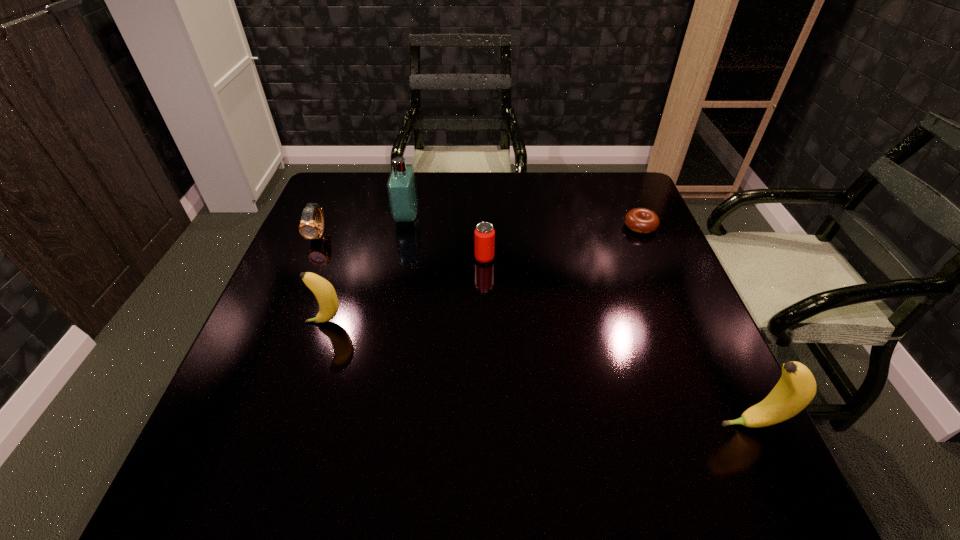
Identify the location of unoccupied area between the fourth object from left to right and the doughnut. The width and height of the screenshot is (960, 540). (563, 242).

Locate which object ranks in proximity to the leftmost object. Please provide its 2D coordinates. Your answer should be formatted as a tuple, i.e. [(x, y)], where the tuple contains the x and y coordinates of a point satisfying the conditions above.

[(402, 192)]

At what (x,y) coordinates should I click in order to perform the action: click on object that is the fourth closest to the shortest object. Please return your answer as a coordinate pair (x, y). This screenshot has height=540, width=960. Looking at the image, I should click on (323, 290).

The width and height of the screenshot is (960, 540). In order to click on free space that satisfies the following two spatial constraints: 1. on the front label of the shortest object; 2. on the right side of the perfume in this screenshot , I will do `click(405, 226)`.

You are a GUI agent. You are given a task and a screenshot of the screen. Output one action in this format:
    pyautogui.click(x=<x>, y=<y>)
    Task: Click on the vacant position in the image that satisfies the following two spatial constraints: 1. on the front label of the perfume; 2. on the left side of the third object from right to left
    The height and width of the screenshot is (540, 960).
    Given the screenshot: What is the action you would take?
    pyautogui.click(x=398, y=258)

Where is `vacant space that satisfies the following two spatial constraints: 1. on the front label of the third object from left to right; 2. on the back side of the shortest object`? This screenshot has width=960, height=540. vacant space that satisfies the following two spatial constraints: 1. on the front label of the third object from left to right; 2. on the back side of the shortest object is located at coordinates click(x=405, y=226).

What are the coordinates of `free location that satisfies the following two spatial constraints: 1. on the front label of the fourth object from right to left; 2. on the face of the leftmost object` in the screenshot? It's located at (403, 235).

You are a GUI agent. You are given a task and a screenshot of the screen. Output one action in this format:
    pyautogui.click(x=<x>, y=<y>)
    Task: Click on the free space that satisfies the following two spatial constraints: 1. on the front label of the perfume; 2. on the face of the leftmost object
    Image resolution: width=960 pixels, height=540 pixels.
    Given the screenshot: What is the action you would take?
    pyautogui.click(x=403, y=235)